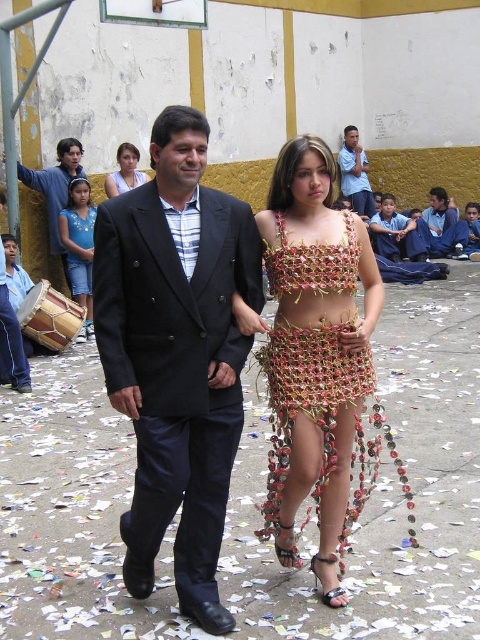
Between matte black suit at center and blue striped shirt at upper center, which one has less height?

matte black suit at center is shorter.

Is point (412, 225) in front of point (365, 205)?

Yes, it is.

Measure the distance between matte black suit at center and camera.

matte black suit at center is 43.50 feet away from camera.

Where is `matte black suit at center`? This screenshot has width=480, height=640. matte black suit at center is located at coordinates (395, 234).

Between metallic woven bikini top at center and matte black suit at upper left, which one appears on the right side from the viewer's perspective?

metallic woven bikini top at center

Does metallic woven bikini top at center appear on the right side of matte black suit at upper left?

Indeed, metallic woven bikini top at center is positioned on the right side of matte black suit at upper left.

Which is in front, point (316, 246) or point (56, 200)?

Point (316, 246) is in front.

Where is `metallic woven bikini top at center`? Image resolution: width=480 pixels, height=640 pixels. metallic woven bikini top at center is located at coordinates (312, 262).

Is metallic woven bikini top at center above blue denim jacket at upper right?

Incorrect, metallic woven bikini top at center is not positioned above blue denim jacket at upper right.

Which of these two, metallic woven bikini top at center or blue denim jacket at upper right, stands shorter?

metallic woven bikini top at center is shorter.

Find the location of a particular element. This screenshot has width=480, height=640. metallic woven bikini top at center is located at coordinates (312, 262).